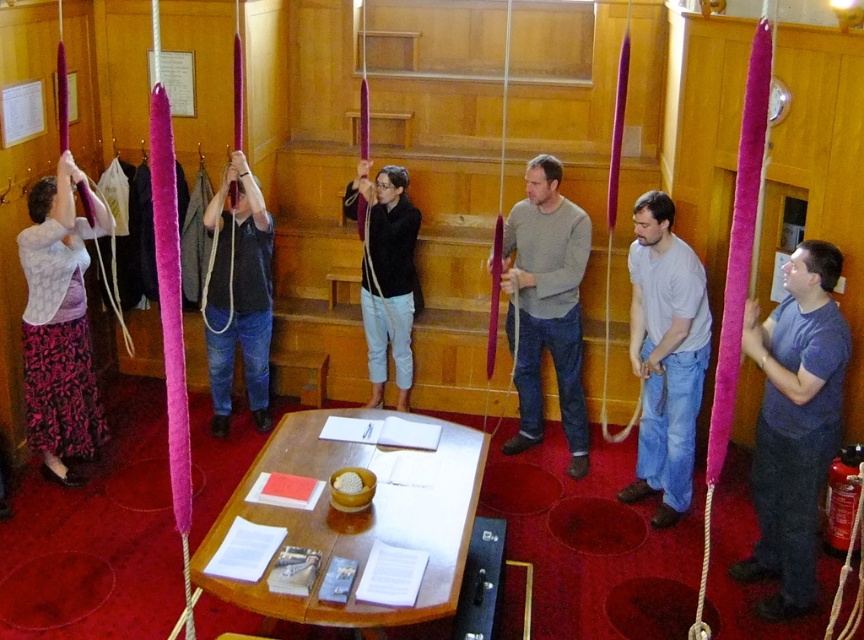
You are standing in the wooden room and want to move from point A to point B. Point A is at coordinate point (473, 486) and point B is at coordinate point (502, 97). Which point is closer to you when you first enter the room?

Point A at coordinate point (473, 486) is closer to you than point B at coordinate point (502, 97) because the description states that point (473, 486) is closer to the viewer than point (502, 97).

You are organizing a small event in the room and need to place a 1.5 meter wide tablecloth on the wooden table at center. Can the matte purple rope at center be placed along the length of the tablecloth without overlapping?

The wooden table at center is wider than the matte purple rope at center, so yes, the matte purple rope at center can be placed along the length of the tablecloth without overlapping since the table is wider than the rope.